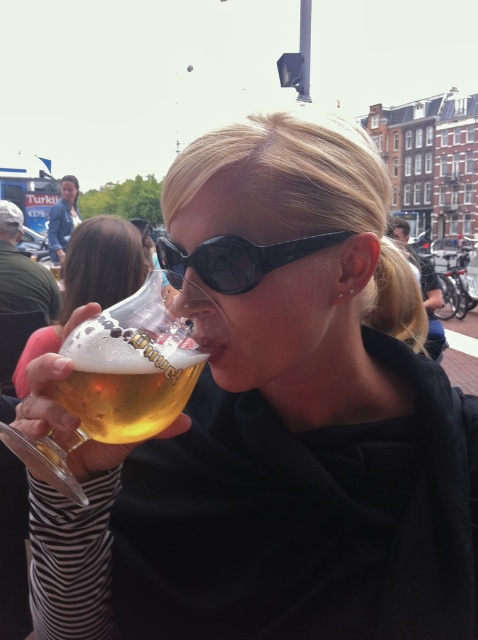
Image resolution: width=478 pixels, height=640 pixels. Describe the element at coordinates (90, 280) in the screenshot. I see `translucent glass beer at lower left` at that location.

Does translucent glass beer at lower left appear under blue denim jacket at upper left?

Correct, translucent glass beer at lower left is located below blue denim jacket at upper left.

Describe the element at coordinates (90, 280) in the screenshot. I see `translucent glass beer at lower left` at that location.

Locate an element on the screen. translucent glass beer at lower left is located at coordinates (90, 280).

Does point (156, 348) come closer to viewer compared to point (293, 256)?

Yes.

Does golden glass beer at center come behind black plastic sunglasses at center?

No, golden glass beer at center is closer to the viewer.

Find the location of a particular element. The height and width of the screenshot is (640, 478). golden glass beer at center is located at coordinates coord(126,380).

Find the location of a particular element. The width and height of the screenshot is (478, 640). golden glass beer at center is located at coordinates (126, 380).

Who is taller, golden glass beer at center or blue denim jacket at upper left?

blue denim jacket at upper left

Can you confirm if golden glass beer at center is smaller than blue denim jacket at upper left?

Indeed, golden glass beer at center has a smaller size compared to blue denim jacket at upper left.

Does point (177, 413) come behind point (51, 241)?

No, it is in front of (51, 241).

At what (x,y) coordinates should I click in order to perform the action: click on golden glass beer at center. Please return your answer as a coordinate pair (x, y). Looking at the image, I should click on (126, 380).